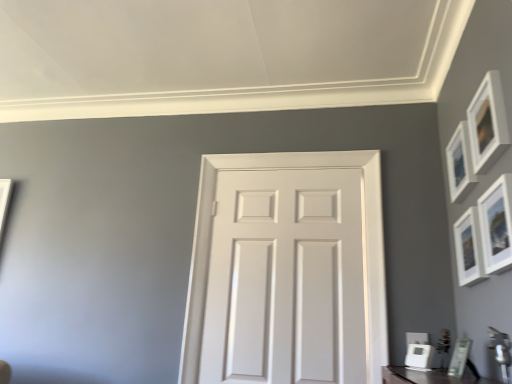
Question: Is white matte door at center oriented towards white matte picture frame at upper right, the fourth picture frame positioned from the top?

Choices:
 (A) yes
 (B) no

Answer: (B)

Question: Would you say white matte picture frame at upper right, the fourth picture frame positioned from the top, is part of white matte door at center's contents?

Choices:
 (A) no
 (B) yes

Answer: (A)

Question: From the image's perspective, is white matte door at center located beneath white matte picture frame at upper right, the fourth picture frame positioned from the top?

Choices:
 (A) yes
 (B) no

Answer: (A)

Question: Is white matte door at center at the right side of white matte picture frame at upper right, the fourth picture frame positioned from the top?

Choices:
 (A) yes
 (B) no

Answer: (B)

Question: From a real-world perspective, is white matte door at center on top of white matte picture frame at upper right, the fourth picture frame positioned from the top?

Choices:
 (A) no
 (B) yes

Answer: (A)

Question: Considering the relative sizes of white matte door at center and white matte picture frame at upper right, the fourth picture frame positioned from the top, in the image provided, is white matte door at center smaller than white matte picture frame at upper right, the fourth picture frame positioned from the top,?

Choices:
 (A) yes
 (B) no

Answer: (B)

Question: Would you say matte white picture frame at upper right, arranged as the sixth picture frame when ordered from the bottom, contains white matte picture frame at upper right, which is the third picture frame from bottom to top?

Choices:
 (A) yes
 (B) no

Answer: (B)

Question: Is matte white picture frame at upper right, arranged as the sixth picture frame when ordered from the bottom, positioned in front of white matte picture frame at upper right, which is the third picture frame from bottom to top?

Choices:
 (A) yes
 (B) no

Answer: (A)

Question: Is matte white picture frame at upper right, arranged as the sixth picture frame when ordered from the bottom, taller than white matte picture frame at upper right, which is the third picture frame from bottom to top?

Choices:
 (A) yes
 (B) no

Answer: (B)

Question: Is matte white picture frame at upper right, the first picture frame when ordered from top to bottom, bigger than white matte picture frame at upper right, which is the third picture frame from bottom to top?

Choices:
 (A) no
 (B) yes

Answer: (A)

Question: Considering the relative sizes of matte white picture frame at upper right, the first picture frame when ordered from top to bottom, and white matte picture frame at upper right, the fourth picture frame positioned from the top, in the image provided, is matte white picture frame at upper right, the first picture frame when ordered from top to bottom, shorter than white matte picture frame at upper right, the fourth picture frame positioned from the top,?

Choices:
 (A) yes
 (B) no

Answer: (A)

Question: Is matte white picture frame at upper right, the first picture frame when ordered from top to bottom, further to camera compared to white matte picture frame at upper right, which is the third picture frame from bottom to top?

Choices:
 (A) no
 (B) yes

Answer: (A)

Question: Is white glossy picture frame at lower right, which is counted as the 1th picture frame, starting from the bottom, in front of matte white picture frame at lower right, which ranks as the fifth picture frame in top-to-bottom order?

Choices:
 (A) yes
 (B) no

Answer: (B)